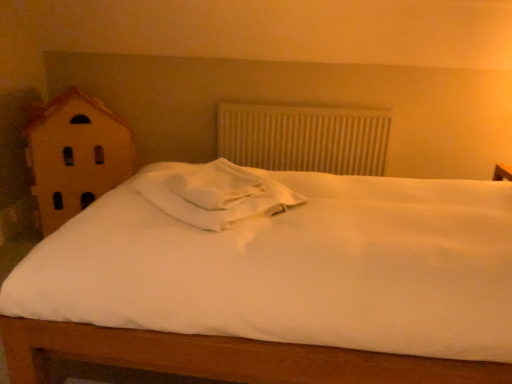
Question: Considering the positions of point (189, 208) and point (276, 119), is point (189, 208) closer or farther from the camera than point (276, 119)?

Choices:
 (A) closer
 (B) farther

Answer: (A)

Question: From a real-world perspective, is white soft pillow at center physically located above or below white textured radiator at center?

Choices:
 (A) below
 (B) above

Answer: (B)

Question: Which object is positioned farthest from the white textured radiator at center?

Choices:
 (A) white soft pillow at center
 (B) wooden house at left

Answer: (A)

Question: Estimate the real-world distances between objects in this image. Which object is farther from the wooden house at left?

Choices:
 (A) white textured radiator at center
 (B) white soft pillow at center

Answer: (B)